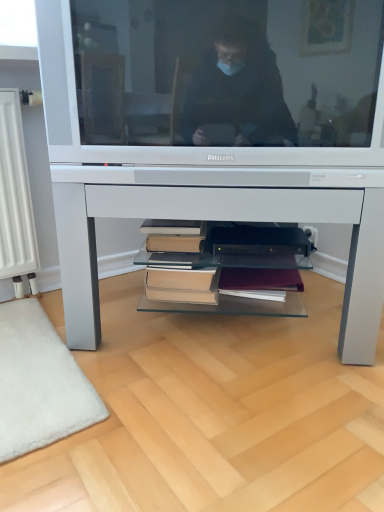
Question: Is white glossy desk at center with hardcover books at center?

Choices:
 (A) no
 (B) yes

Answer: (A)

Question: Considering the relative positions of white glossy desk at center and hardcover books at center in the image provided, is white glossy desk at center to the left of hardcover books at center from the viewer's perspective?

Choices:
 (A) yes
 (B) no

Answer: (B)

Question: Is white glossy desk at center smaller than hardcover books at center?

Choices:
 (A) no
 (B) yes

Answer: (A)

Question: Is white glossy desk at center further to camera compared to hardcover books at center?

Choices:
 (A) no
 (B) yes

Answer: (A)

Question: Considering the relative sizes of white glossy desk at center and hardcover books at center in the image provided, is white glossy desk at center shorter than hardcover books at center?

Choices:
 (A) no
 (B) yes

Answer: (A)

Question: Do you think white glossy desk at center is within hardcover books at center, or outside of it?

Choices:
 (A) inside
 (B) outside

Answer: (B)

Question: From a real-world perspective, relative to hardcover books at center, is white glossy desk at center vertically above or below?

Choices:
 (A) below
 (B) above

Answer: (B)

Question: From the image's perspective, relative to hardcover books at center, is white glossy desk at center above or below?

Choices:
 (A) above
 (B) below

Answer: (A)

Question: Does point (175, 187) appear closer or farther from the camera than point (177, 225)?

Choices:
 (A) closer
 (B) farther

Answer: (A)

Question: From their relative heights in the image, would you say matte silver television at center is taller or shorter than hardcover books at center?

Choices:
 (A) tall
 (B) short

Answer: (A)

Question: In terms of width, does matte silver television at center look wider or thinner when compared to hardcover books at center?

Choices:
 (A) wide
 (B) thin

Answer: (A)

Question: From a real-world perspective, relative to hardcover books at center, is matte silver television at center vertically above or below?

Choices:
 (A) below
 (B) above

Answer: (B)

Question: From the image's perspective, is matte silver television at center positioned above or below hardcover books at center?

Choices:
 (A) below
 (B) above

Answer: (B)

Question: From a real-world perspective, is hardcover books at center physically located above or below matte silver television at center?

Choices:
 (A) below
 (B) above

Answer: (A)

Question: Is hardcover books at center wider or thinner than matte silver television at center?

Choices:
 (A) thin
 (B) wide

Answer: (A)